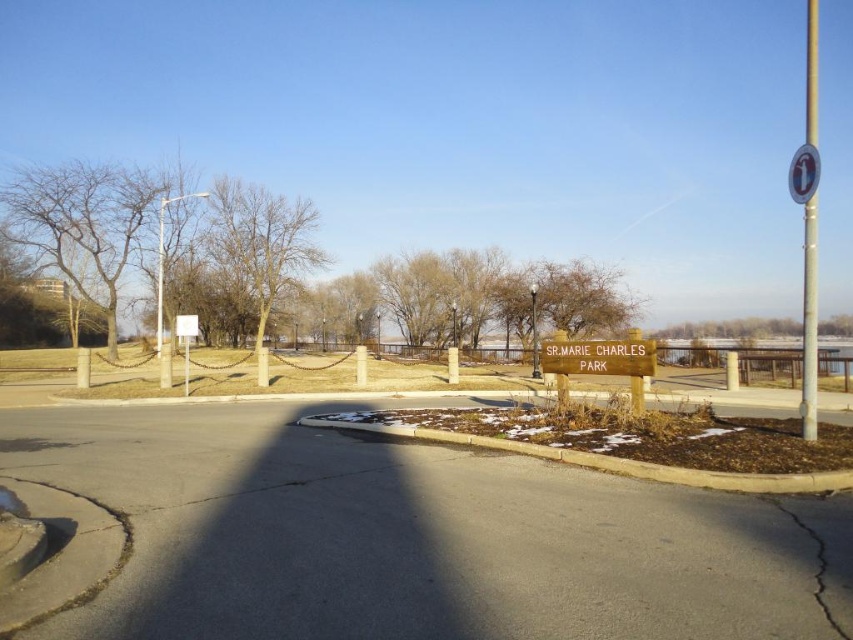
You are planning to place a new bench between the bare wood tree at center and the brown wooden sign at center. Based on their widths, which object should you place the bench closer to to ensure it doesn not block the narrower one?

The brown wooden sign at center is narrower than the bare wood tree at center, so you should place the bench closer to the brown wooden sign at center to avoid blocking it.

You are standing at the park entrance and want to take a photo of both the bare wood tree at center and the brown wooden sign at center. Which object should you focus on first to ensure both are in clear view?

You should focus on the brown wooden sign at center first because the bare wood tree at center is closer to you, so adjusting focus starting from the closer object ensures both are in clear view.

You are a park maintenance worker who needs to place a 20 feet long safety barrier between the metallic pole at right and the white plastic circle at upper right. Can you fit the barrier between them without overlapping either object?

The distance between the metallic pole at right and the white plastic circle at upper right is 24.09 feet. Since the safety barrier is 20 feet long, it can be placed between them without overlapping either object as there is sufficient space.